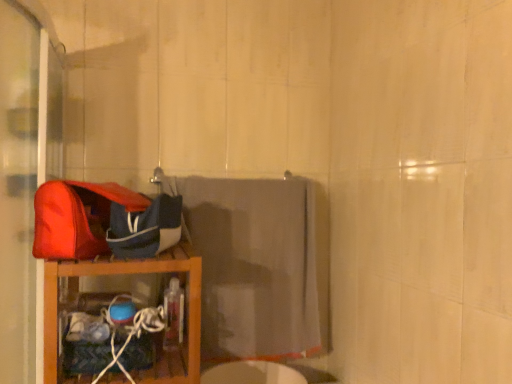
Question: Considering the positions of matte red shoulder bag at left and wooden shelf at left in the image, is matte red shoulder bag at left bigger or smaller than wooden shelf at left?

Choices:
 (A) big
 (B) small

Answer: (B)

Question: Considering the positions of matte red shoulder bag at left and wooden shelf at left in the image, is matte red shoulder bag at left taller or shorter than wooden shelf at left?

Choices:
 (A) tall
 (B) short

Answer: (B)

Question: Considering the real-world distances, which object is closest to the wooden shelf at left?

Choices:
 (A) matte red shoulder bag at left
 (B) blue fabric bag at left
 (C) gray fabric towel at center

Answer: (B)

Question: Which of these objects is positioned closest to the gray fabric towel at center?

Choices:
 (A) blue fabric bag at left
 (B) wooden shelf at left
 (C) matte red shoulder bag at left

Answer: (B)